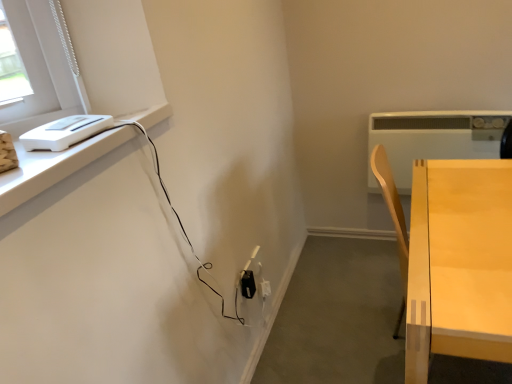
Question: Can you confirm if black plastic electric outlet at lower center is thinner than light wood table at right?

Choices:
 (A) yes
 (B) no

Answer: (A)

Question: From a real-world perspective, is black plastic electric outlet at lower center physically above light wood table at right?

Choices:
 (A) no
 (B) yes

Answer: (A)

Question: Does black plastic electric outlet at lower center lie behind light wood table at right?

Choices:
 (A) no
 (B) yes

Answer: (B)

Question: Does black plastic electric outlet at lower center appear on the left side of light wood table at right?

Choices:
 (A) no
 (B) yes

Answer: (B)

Question: Is black plastic electric outlet at lower center located outside light wood table at right?

Choices:
 (A) no
 (B) yes

Answer: (B)

Question: From the image's perspective, is black plastic electric outlet at lower center under light wood table at right?

Choices:
 (A) no
 (B) yes

Answer: (B)

Question: Can you confirm if light wood table at right is smaller than white plastic heater at upper right, the 1th appliance in the back-to-front sequence?

Choices:
 (A) yes
 (B) no

Answer: (B)

Question: Is light wood table at right completely or partially outside of white plastic heater at upper right, the second appliance when ordered from left to right?

Choices:
 (A) yes
 (B) no

Answer: (A)

Question: Would you consider light wood table at right to be distant from white plastic heater at upper right, the 1th appliance in the back-to-front sequence?

Choices:
 (A) no
 (B) yes

Answer: (A)

Question: From the image's perspective, is light wood table at right under white plastic heater at upper right, the 1th appliance when ordered from right to left?

Choices:
 (A) no
 (B) yes

Answer: (B)

Question: Is light wood table at right further to camera compared to white plastic heater at upper right, the 1th appliance in the back-to-front sequence?

Choices:
 (A) yes
 (B) no

Answer: (B)

Question: Is light wood table at right facing away from white plastic heater at upper right, the 2th appliance viewed from the front?

Choices:
 (A) yes
 (B) no

Answer: (B)

Question: Can you confirm if black plastic electric outlet at lower center is positioned to the right of white plastic heater at upper right, the 2th appliance viewed from the front?

Choices:
 (A) yes
 (B) no

Answer: (B)